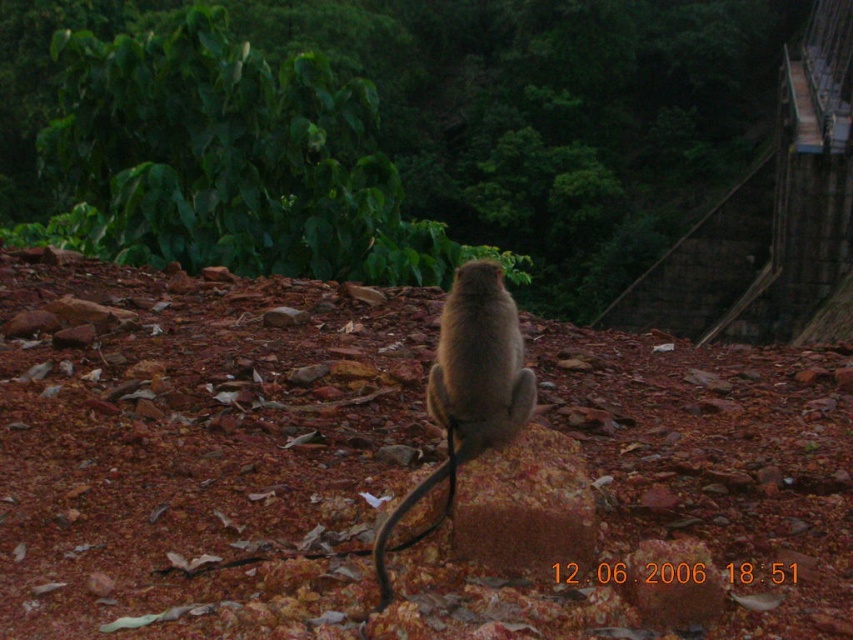
Is green leafy tree at upper center closer to camera compared to furry brown monkey at center?

That is False.

Who is lower down, green leafy tree at upper center or furry brown monkey at center?

furry brown monkey at center is below.

Image resolution: width=853 pixels, height=640 pixels. What do you see at coordinates (553, 115) in the screenshot?
I see `green leafy tree at upper center` at bounding box center [553, 115].

The width and height of the screenshot is (853, 640). Find the location of `green leafy tree at upper center`. green leafy tree at upper center is located at coordinates (553, 115).